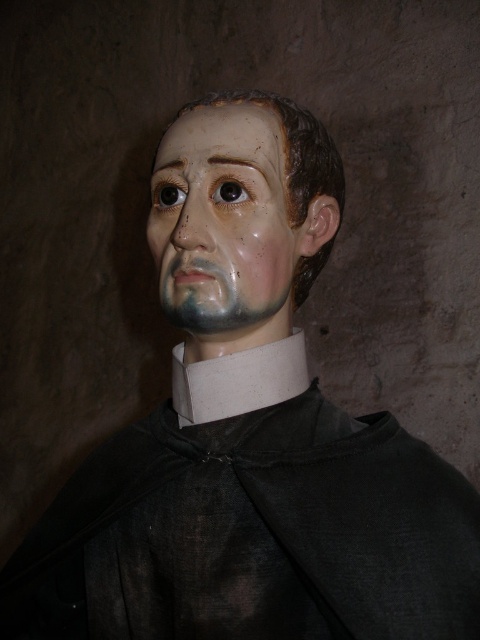
Is black matte robe at center positioned behind matte plastic nose at center?

No, black matte robe at center is in front of matte plastic nose at center.

Which is below, black matte robe at center or matte plastic nose at center?

Positioned lower is black matte robe at center.

Does point (464, 564) lie in front of point (197, 196)?

Yes, it is in front of point (197, 196).

Image resolution: width=480 pixels, height=640 pixels. Identify the location of black matte robe at center. (252, 534).

Can you confirm if black matte robe at center is positioned below matte painted face at center?

Indeed, black matte robe at center is positioned under matte painted face at center.

Where is `black matte robe at center`? black matte robe at center is located at coordinates (252, 534).

Which is more to the right, matte painted face at center or matte plastic nose at center?

matte painted face at center

Does matte painted face at center have a larger size compared to matte plastic nose at center?

Indeed, matte painted face at center has a larger size compared to matte plastic nose at center.

At what (x,y) coordinates should I click in order to perform the action: click on matte painted face at center. Please return your answer as a coordinate pair (x, y). The height and width of the screenshot is (640, 480). Looking at the image, I should click on (223, 221).

Find the location of `matte painted face at center`. matte painted face at center is located at coordinates (223, 221).